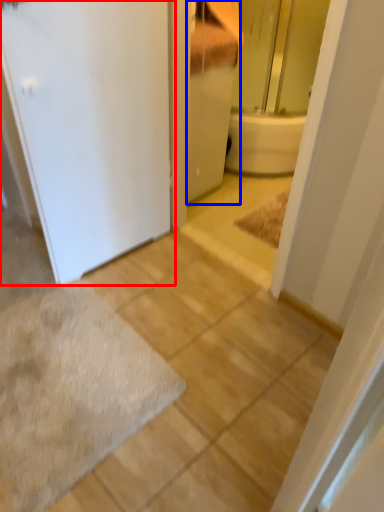
Question: Among these objects, which one is farthest to the camera, door (highlighted by a red box) or bathroom cabinet (highlighted by a blue box)?

Choices:
 (A) door
 (B) bathroom cabinet

Answer: (B)